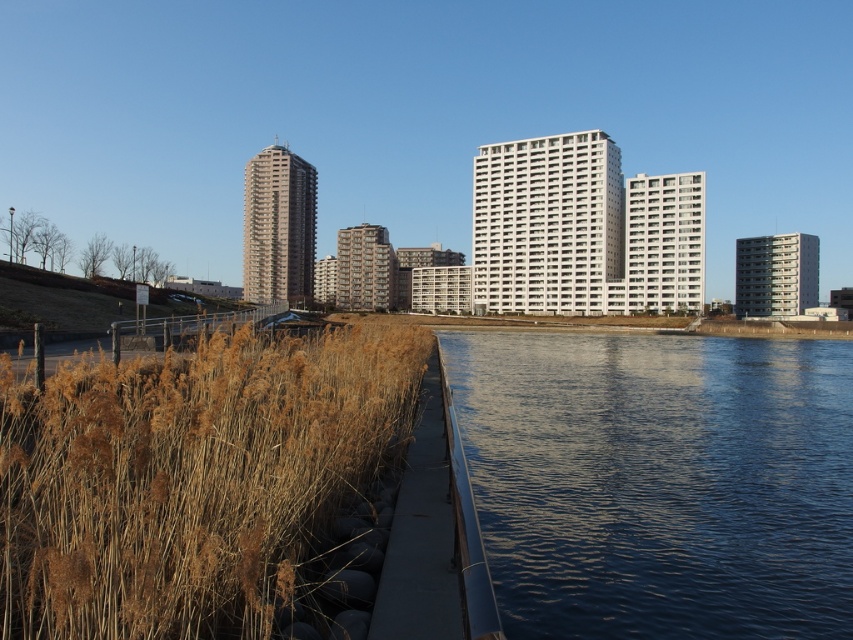
Question: Does blue smooth water at lower right have a lesser width compared to dry grass at lower left?

Choices:
 (A) yes
 (B) no

Answer: (B)

Question: Which point is closer to the camera taking this photo?

Choices:
 (A) (758, 588)
 (B) (28, 545)

Answer: (B)

Question: Which object is farther from the camera taking this photo?

Choices:
 (A) dry grass at lower left
 (B) blue smooth water at lower right

Answer: (B)

Question: In this image, where is blue smooth water at lower right located relative to dry grass at lower left?

Choices:
 (A) below
 (B) above

Answer: (A)

Question: Does blue smooth water at lower right have a larger size compared to dry grass at lower left?

Choices:
 (A) yes
 (B) no

Answer: (A)